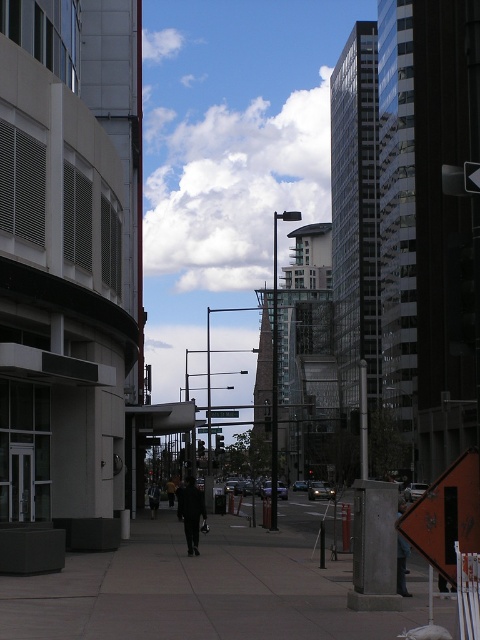
Does gray concrete sidewalk at center appear under dark gray jacket at lower right?

Correct, gray concrete sidewalk at center is located below dark gray jacket at lower right.

Does gray concrete sidewalk at center appear on the right side of dark gray jacket at lower right?

No, gray concrete sidewalk at center is not to the right of dark gray jacket at lower right.

Find the location of a particular element. Image resolution: width=480 pixels, height=640 pixels. gray concrete sidewalk at center is located at coordinates (202, 588).

Which is in front, point (193, 500) or point (151, 497)?

Point (193, 500) is in front.

Is point (194, 481) in front of point (152, 486)?

Yes, point (194, 481) is closer to viewer.

Find the location of a particular element. This screenshot has width=480, height=640. dark wool coat at center is located at coordinates (191, 513).

What do you see at coordinates (402, 564) in the screenshot? The height and width of the screenshot is (640, 480). I see `dark gray jacket at lower right` at bounding box center [402, 564].

Is dark gray jacket at lower right further to camera compared to metallic street sign at center?

No, dark gray jacket at lower right is closer to the viewer.

You are a GUI agent. You are given a task and a screenshot of the screen. Output one action in this format:
    pyautogui.click(x=<x>, y=<y>)
    Task: Click on the dark gray jacket at lower right
    
    Given the screenshot: What is the action you would take?
    pyautogui.click(x=402, y=564)